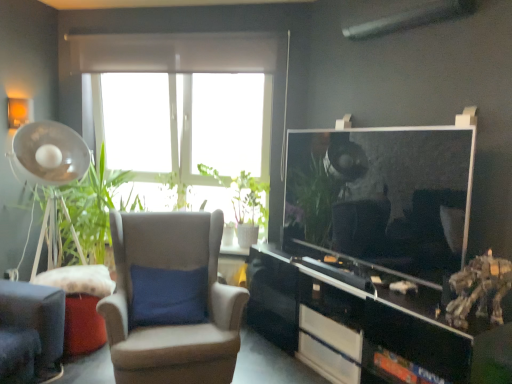
Question: From the image's perspective, is black glossy cabinet at lower right under white glossy drawer at lower center, which is the 1th drawer in top-to-bottom order?

Choices:
 (A) yes
 (B) no

Answer: (B)

Question: Considering the relative sizes of black glossy cabinet at lower right and white glossy drawer at lower center, which is the 1th drawer in top-to-bottom order, in the image provided, is black glossy cabinet at lower right bigger than white glossy drawer at lower center, which is the 1th drawer in top-to-bottom order,?

Choices:
 (A) yes
 (B) no

Answer: (A)

Question: Is black glossy cabinet at lower right not within white glossy drawer at lower center, which ranks as the 2th drawer in bottom-to-top order?

Choices:
 (A) yes
 (B) no

Answer: (A)

Question: Is black glossy cabinet at lower right turned away from white glossy drawer at lower center, which ranks as the 2th drawer in bottom-to-top order?

Choices:
 (A) no
 (B) yes

Answer: (B)

Question: Does black glossy cabinet at lower right come in front of white glossy drawer at lower center, which is the 1th drawer in top-to-bottom order?

Choices:
 (A) no
 (B) yes

Answer: (B)

Question: Looking at their shapes, would you say white glossy drawer at lower center, which is the 1th drawer in top-to-bottom order, is wider or thinner than white glossy drawer at lower center, placed as the 2th drawer when sorted from top to bottom?

Choices:
 (A) wide
 (B) thin

Answer: (A)

Question: From a real-world perspective, is white glossy drawer at lower center, which ranks as the 2th drawer in bottom-to-top order, positioned above or below white glossy drawer at lower center, placed as the first drawer when sorted from bottom to top?

Choices:
 (A) above
 (B) below

Answer: (A)

Question: Looking at the image, does white glossy drawer at lower center, which is the 1th drawer in top-to-bottom order, seem bigger or smaller compared to white glossy drawer at lower center, placed as the 2th drawer when sorted from top to bottom?

Choices:
 (A) big
 (B) small

Answer: (A)

Question: From their relative heights in the image, would you say white glossy drawer at lower center, which ranks as the 2th drawer in bottom-to-top order, is taller or shorter than white glossy drawer at lower center, placed as the first drawer when sorted from bottom to top?

Choices:
 (A) tall
 (B) short

Answer: (A)

Question: In terms of height, does white glossy drawer at lower center, which ranks as the 2th drawer in bottom-to-top order, look taller or shorter compared to black glossy cabinet at lower right?

Choices:
 (A) short
 (B) tall

Answer: (A)

Question: In terms of width, does white glossy drawer at lower center, which ranks as the 2th drawer in bottom-to-top order, look wider or thinner when compared to black glossy cabinet at lower right?

Choices:
 (A) wide
 (B) thin

Answer: (B)

Question: Relative to black glossy cabinet at lower right, is white glossy drawer at lower center, which ranks as the 2th drawer in bottom-to-top order, in front or behind?

Choices:
 (A) front
 (B) behind

Answer: (B)

Question: From the image's perspective, relative to black glossy cabinet at lower right, is white glossy drawer at lower center, which ranks as the 2th drawer in bottom-to-top order, above or below?

Choices:
 (A) below
 (B) above

Answer: (A)

Question: From the image's perspective, is black glossy cabinet at lower right located above or below suede wingback chair at center?

Choices:
 (A) above
 (B) below

Answer: (B)

Question: Does point (485, 326) appear closer or farther from the camera than point (120, 327)?

Choices:
 (A) farther
 (B) closer

Answer: (B)